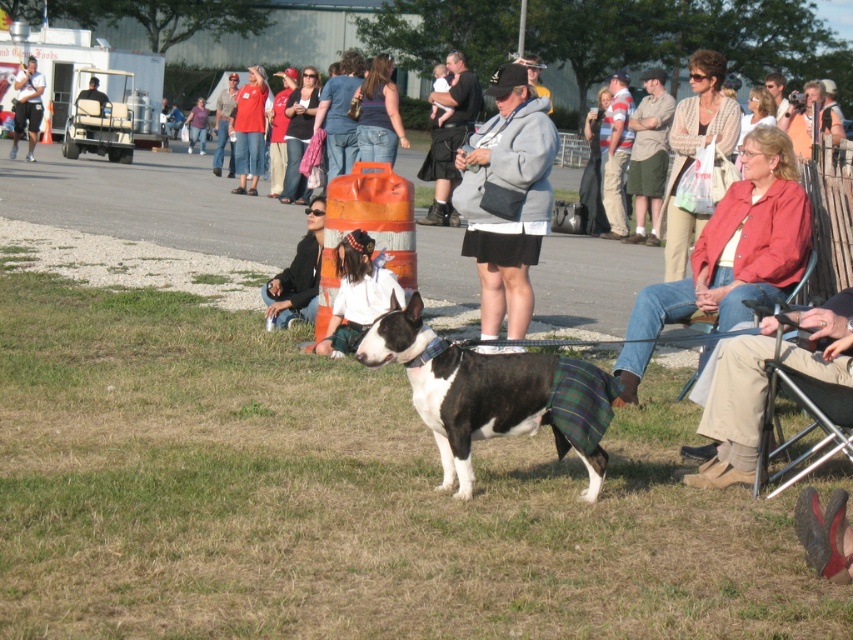
You are a photographer at the dog show and need to position yourself so that the black and white dog at center is directly to the right of the green grass at center in your photo. Based on their current positions, is this possible without moving either object?

The green grass at center is already to the left of the black and white dog at center, so positioning the black and white dog at center directly to the right of the green grass at center is possible without moving them.

You are a photographer at the event and need to decide which clothing item to focus on for a closeup. Since the black leather jacket at center and the striped cotton shirt at center are both at the center, which one is shorter in height?

The black leather jacket at center is not as tall as the striped cotton shirt at center, so the black leather jacket at center is shorter in height.

You are a photographer at the event and want to capture both the black leather jacket at center and the striped cotton shirt at center in a single photo. Which clothing item should you focus on first to ensure both are in frame?

The black leather jacket at center is in front of the striped cotton shirt at center, so you should focus on the black leather jacket at center first to ensure both are visible in the photo.